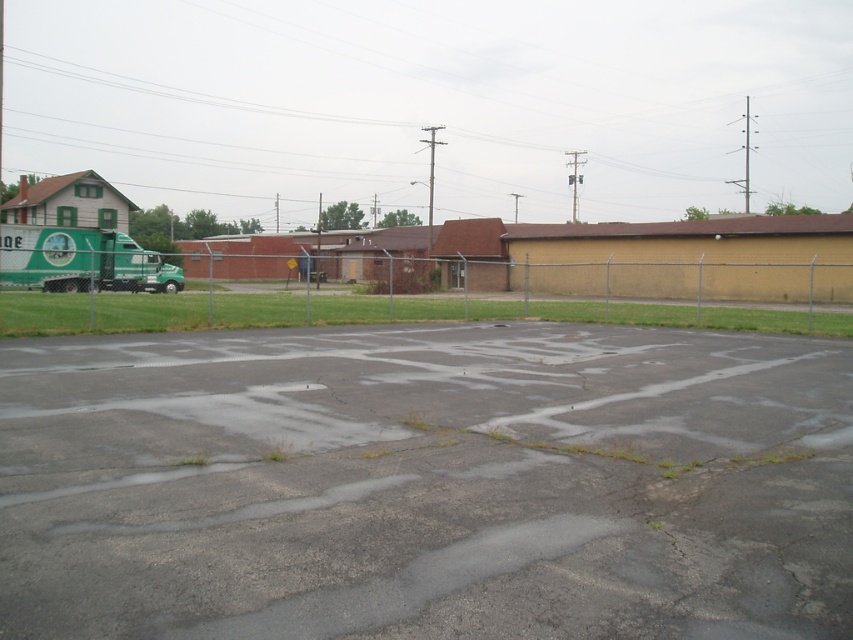
Question: Which object is closer to the camera taking this photo?

Choices:
 (A) metallic chain-link fence at center
 (B) gray asphalt parking lot at center

Answer: (B)

Question: Which object appears closest to the camera in this image?

Choices:
 (A) metallic chain-link fence at center
 (B) gray asphalt parking lot at center

Answer: (B)

Question: Where is gray asphalt parking lot at center located in relation to metallic chain-link fence at center in the image?

Choices:
 (A) left
 (B) right

Answer: (A)

Question: Does gray asphalt parking lot at center lie in front of metallic chain-link fence at center?

Choices:
 (A) no
 (B) yes

Answer: (B)

Question: Is gray asphalt parking lot at center above metallic chain-link fence at center?

Choices:
 (A) no
 (B) yes

Answer: (A)